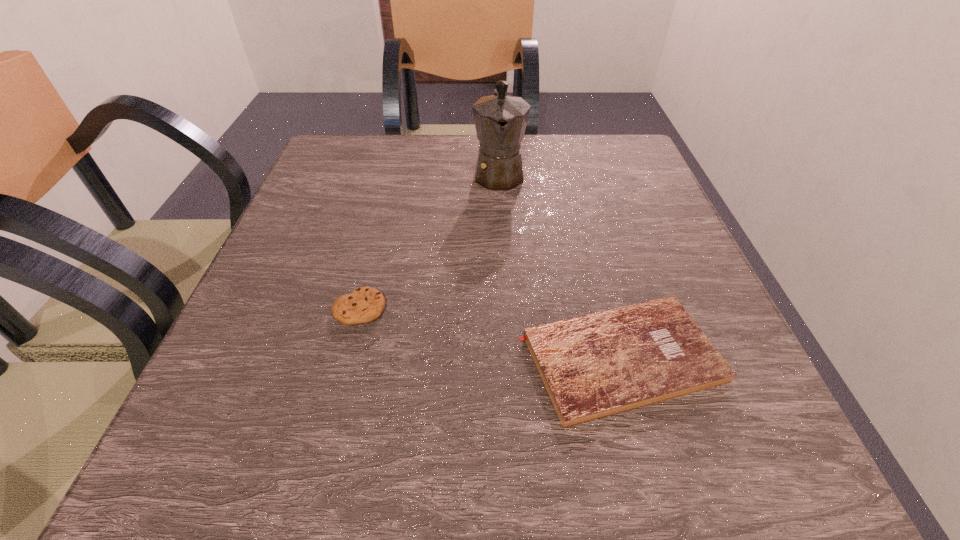
You are a GUI agent. You are given a task and a screenshot of the screen. Output one action in this format:
    pyautogui.click(x=<x>, y=<y>)
    Task: Click on the free space between the farthest object and the cookie
    This screenshot has height=540, width=960.
    Given the screenshot: What is the action you would take?
    pyautogui.click(x=429, y=241)

At what (x,y) coordinates should I click in order to perform the action: click on vacant space in between the farthest object and the Bible. Please return your answer as a coordinate pair (x, y). The image size is (960, 540). Looking at the image, I should click on (560, 266).

Identify the location of vacant region between the coffeepot and the cookie. The image size is (960, 540). (429, 241).

At what (x,y) coordinates should I click in order to perform the action: click on free area in between the coffeepot and the leftmost object. Please return your answer as a coordinate pair (x, y). This screenshot has width=960, height=540. Looking at the image, I should click on (429, 241).

Where is `free space between the Bible and the leftmost object`? free space between the Bible and the leftmost object is located at coordinates (490, 334).

The image size is (960, 540). Identify the location of unoccupied area between the leftmost object and the farthest object. (429, 241).

Identify the location of free space that is in between the coffeepot and the Bible. (560, 266).

The width and height of the screenshot is (960, 540). I want to click on unoccupied area between the coffeepot and the Bible, so click(560, 266).

Identify which object is the closest to the coffeepot. Please provide its 2D coordinates. Your answer should be formatted as a tuple, i.e. [(x, y)], where the tuple contains the x and y coordinates of a point satisfying the conditions above.

[(593, 366)]

Identify which object is located as the second nearest to the Bible. Please provide its 2D coordinates. Your answer should be formatted as a tuple, i.e. [(x, y)], where the tuple contains the x and y coordinates of a point satisfying the conditions above.

[(500, 120)]